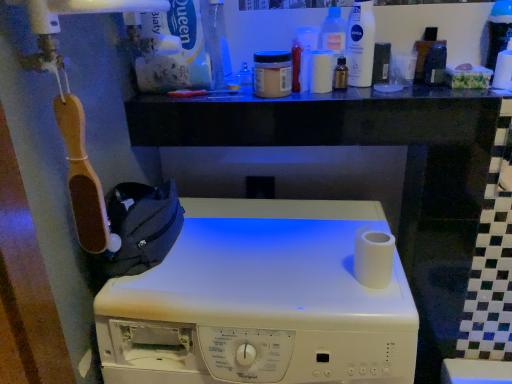
Question: In terms of size, does translucent amber bottle at upper center, the 5th toiletry from the left, appear bigger or smaller than transparent glass bottle at upper center?

Choices:
 (A) big
 (B) small

Answer: (B)

Question: Does point (340, 59) appear closer or farther from the camera than point (228, 61)?

Choices:
 (A) farther
 (B) closer

Answer: (B)

Question: Estimate the real-world distances between objects in this image. Which object is closer to the white plastic washing machine at center?

Choices:
 (A) white plastic container at center, the 3th toiletry in the left-to-right sequence
 (B) white matte bottle at upper center, the 3th toiletry in the right-to-left sequence
 (C) matte black container at upper right, which is counted as the sixth toiletry, starting from the left
 (D) matte brown jar at upper center, which ranks as the second toiletry in left-to-right order
 (E) white plastic bottle at upper center, the 2th cleaning product positioned from the left

Answer: (D)

Question: Based on their relative distances, which object is nearer to the white plastic container at center, the 3th toiletry in the left-to-right sequence?

Choices:
 (A) white matte bottle at upper center, the 4th toiletry viewed from the left
 (B) translucent amber bottle at upper center, the 5th toiletry from the left
 (C) matte brown jar at upper center, which ranks as the second toiletry in left-to-right order
 (D) white matte toilet paper at right, arranged as the 2th toilet paper when viewed from the right
 (E) matte black container at upper right, which is counted as the sixth toiletry, starting from the left

Answer: (A)